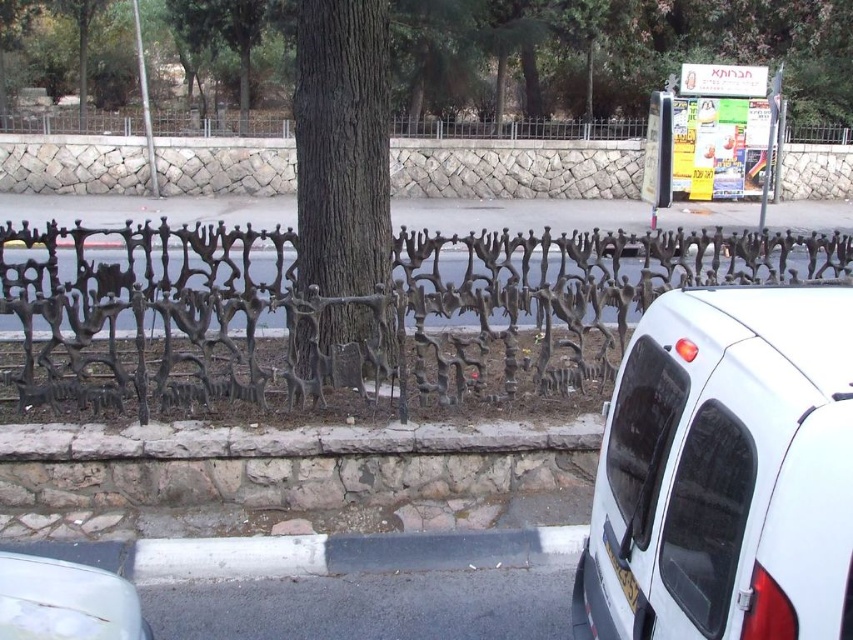
Looking at this image, you are a pedestrian standing at the curb next to the decorative fence. You see a white matte minivan at right and a white glossy car at lower left. Which vehicle is nearer to you?

The white matte minivan at right is closer to the viewer than the white glossy car at lower left, so the white matte minivan at right is nearer to you.

You are a delivery person trying to park your white glossy car at lower left. The brown textured tree at center is blocking the path. Can you drive around it? Please explain based on their widths.

The brown textured tree at center is wider than the white glossy car at lower left. Since the tree is blocking the path and is wider, it would be difficult to drive around it without hitting the tree or going off the path.

You are a delivery driver who needs to park your vehicle in this urban street scene. You have a white matte minivan at right and a white glossy car at lower left. Which vehicle will require more space to park?

The white matte minivan at right has a larger size compared to the white glossy car at lower left, so it will require more space to park.